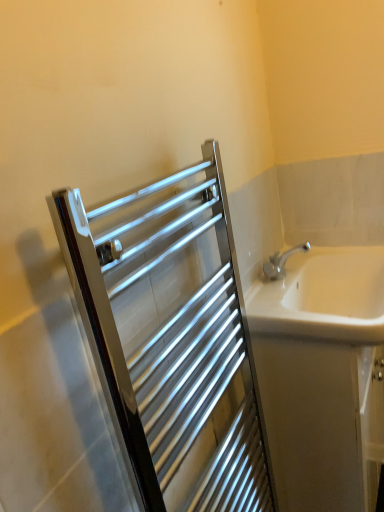
What do you see at coordinates (323, 376) in the screenshot? The width and height of the screenshot is (384, 512). I see `white glossy bathtub at right` at bounding box center [323, 376].

Measure the distance between point (362,328) and camera.

A distance of 1.03 meters exists between point (362,328) and camera.

Locate an element on the screen. white glossy bathtub at right is located at coordinates (323, 376).

Can you tell me how much white ceramic sink at right and white glossy bathtub at right differ in facing direction?

The angular difference between white ceramic sink at right and white glossy bathtub at right is 0.000416 degrees.

Looking at this image, can you confirm if white ceramic sink at right is positioned to the right of white glossy bathtub at right?

No.

Consider the image. From a real-world perspective, who is located higher, white ceramic sink at right or white glossy bathtub at right?

white ceramic sink at right.

The height and width of the screenshot is (512, 384). What are the coordinates of `screen door below the white ceramic sink at right (from a real-world perspective)` in the screenshot? It's located at (172, 339).

From a real-world perspective, is polished chrome towel rack at upper left on top of white ceramic sink at right?

No, from a real-world perspective, polished chrome towel rack at upper left is not above white ceramic sink at right.

From the image's perspective, between polished chrome towel rack at upper left and white ceramic sink at right, which one is located above?

white ceramic sink at right, from the image's perspective.

What's the angular difference between polished chrome towel rack at upper left and white ceramic sink at right's facing directions?

0.786 degrees.

Is point (132, 370) less distant than point (280, 334)?

Yes, point (132, 370) is closer to viewer.

Who is more distant, polished chrome towel rack at upper left or white glossy bathtub at right?

white glossy bathtub at right.

Which object is thinner, polished chrome towel rack at upper left or white glossy bathtub at right?

polished chrome towel rack at upper left is thinner.

Is polished chrome towel rack at upper left touching white glossy bathtub at right?

There is a gap between polished chrome towel rack at upper left and white glossy bathtub at right.

From a real-world perspective, is white glossy bathtub at right located beneath white ceramic sink at right?

Yes, from a real-world perspective, white glossy bathtub at right is beneath white ceramic sink at right.

Is white glossy bathtub at right shorter than white ceramic sink at right?

In fact, white glossy bathtub at right may be taller than white ceramic sink at right.

From the image's perspective, would you say white glossy bathtub at right is positioned over white ceramic sink at right?

No, from the image's perspective, white glossy bathtub at right is not on top of white ceramic sink at right.

How different are the orientations of white glossy bathtub at right and white ceramic sink at right in degrees?

The angular difference between white glossy bathtub at right and white ceramic sink at right is 0.000416 degrees.

Locate an element on the screen. The width and height of the screenshot is (384, 512). bath below the polished chrome towel rack at upper left (from the image's perspective) is located at coordinates (323, 376).

Consider the image. Would you say polished chrome towel rack at upper left is part of white glossy bathtub at right's contents?

No, polished chrome towel rack at upper left is not inside white glossy bathtub at right.

Can you confirm if white glossy bathtub at right is positioned to the right of polished chrome towel rack at upper left?

Indeed, white glossy bathtub at right is positioned on the right side of polished chrome towel rack at upper left.

Does point (352, 261) come behind point (248, 470)?

Yes, point (352, 261) is farther from viewer.

Is white ceramic sink at right positioned before polished chrome towel rack at upper left?

No, white ceramic sink at right is further to the viewer.

Considering the sizes of objects white ceramic sink at right and polished chrome towel rack at upper left in the image provided, who is smaller, white ceramic sink at right or polished chrome towel rack at upper left?

white ceramic sink at right.

Can you confirm if white ceramic sink at right is wider than polished chrome towel rack at upper left?

Correct, the width of white ceramic sink at right exceeds that of polished chrome towel rack at upper left.

At what (x,y) coordinates should I click in order to perform the action: click on sink above the polished chrome towel rack at upper left (from a real-world perspective). Please return your answer as a coordinate pair (x, y). The image size is (384, 512). Looking at the image, I should click on (323, 296).

Find the location of a particular element. This screenshot has width=384, height=512. bath behind the white ceramic sink at right is located at coordinates (323, 376).

The width and height of the screenshot is (384, 512). I want to click on screen door below the white ceramic sink at right (from a real-world perspective), so click(172, 339).

Looking at the image, which one is located further to polished chrome towel rack at upper left, white glossy bathtub at right or white ceramic sink at right?

white ceramic sink at right.

Based on their spatial positions, is white glossy bathtub at right or polished chrome towel rack at upper left closer to white ceramic sink at right?

white glossy bathtub at right.

Looking at the image, which one is located further to polished chrome towel rack at upper left, white ceramic sink at right or white glossy bathtub at right?

white ceramic sink at right is positioned further to the anchor polished chrome towel rack at upper left.

From the picture: Estimate the real-world distances between objects in this image. Which object is further from white glossy bathtub at right, polished chrome towel rack at upper left or white ceramic sink at right?

Based on the image, polished chrome towel rack at upper left appears to be further to white glossy bathtub at right.

Estimate the real-world distances between objects in this image. Which object is closer to white glossy bathtub at right, white ceramic sink at right or polished chrome towel rack at upper left?

white ceramic sink at right.

Based on their spatial positions, is polished chrome towel rack at upper left or white glossy bathtub at right further from white ceramic sink at right?

polished chrome towel rack at upper left is further to white ceramic sink at right.

Identify the location of sink between polished chrome towel rack at upper left and white glossy bathtub at right in the front-back direction. (323, 296).